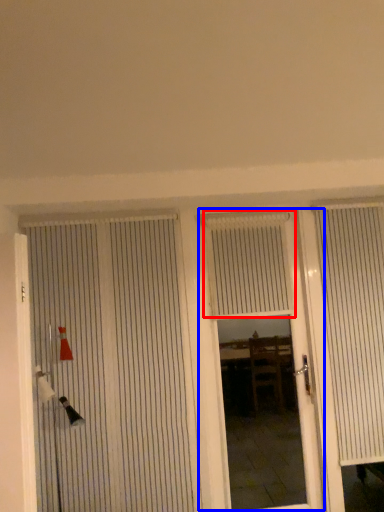
Question: Which object appears closest to the camera in this image, blind (highlighted by a red box) or door (highlighted by a blue box)?

Choices:
 (A) blind
 (B) door

Answer: (B)